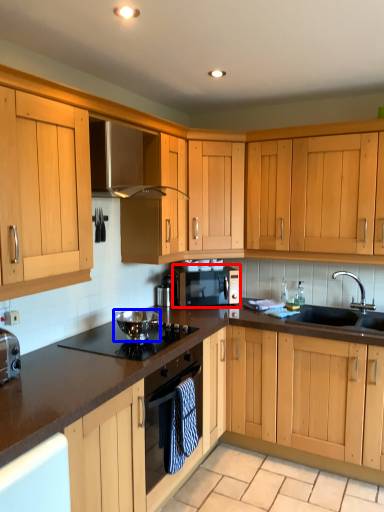
Question: Among these objects, which one is farthest to the camera, microwave oven (highlighted by a red box) or appliance (highlighted by a blue box)?

Choices:
 (A) microwave oven
 (B) appliance

Answer: (A)